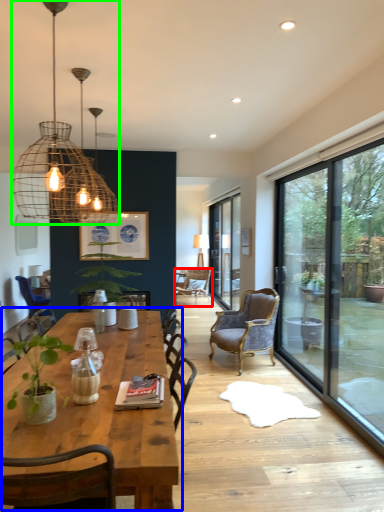
Question: Which object is the closest to the chair (highlighted by a red box)? Choose among these: coffee table (highlighted by a blue box) or lamp (highlighted by a green box).

Choices:
 (A) coffee table
 (B) lamp

Answer: (A)